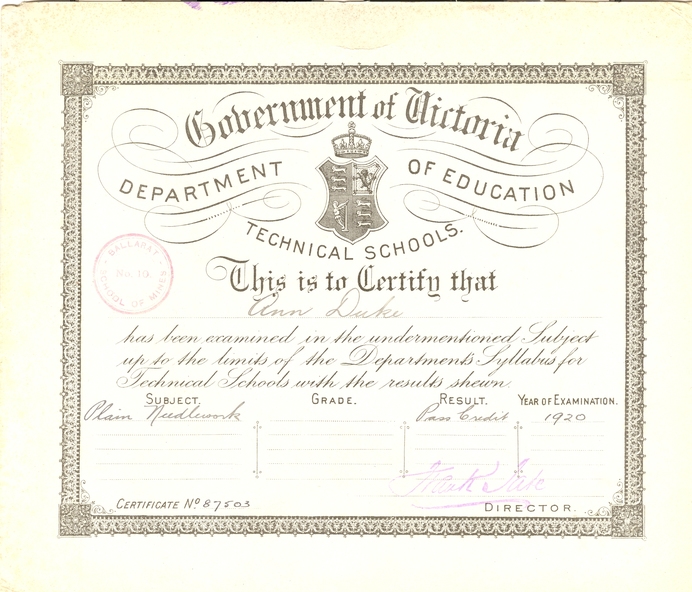
Identify the location of left side border of certificate. (70, 286).